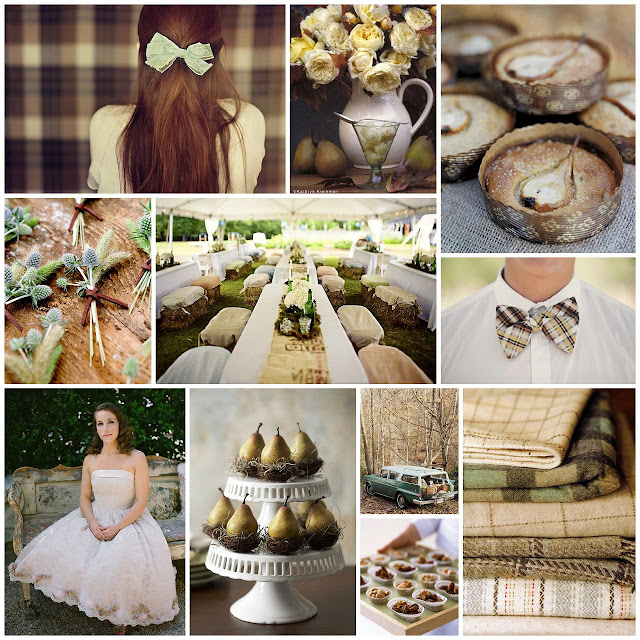
Image resolution: width=640 pixels, height=640 pixels. Find the location of `blankets`. blankets is located at coordinates (552, 553).